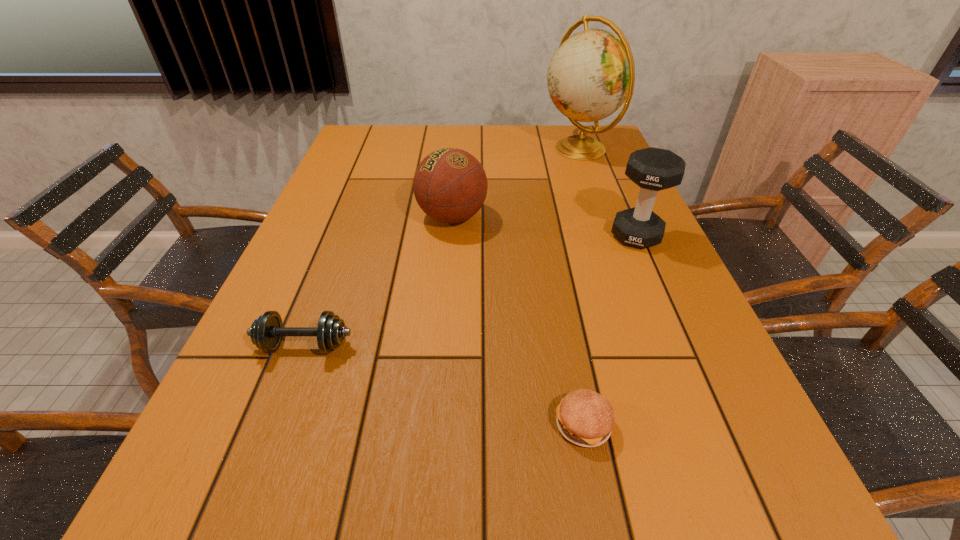
Where is `free space that satisfies the following two spatial constraints: 1. on the back side of the right dumbbell; 2. on the left side of the second shortest object`? The width and height of the screenshot is (960, 540). free space that satisfies the following two spatial constraints: 1. on the back side of the right dumbbell; 2. on the left side of the second shortest object is located at coordinates (346, 236).